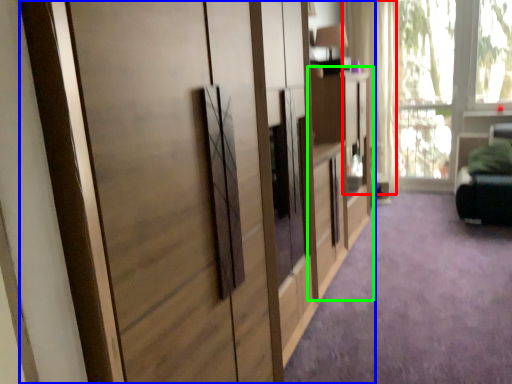
Question: Considering the real-world distances, which object is closest to curtain (highlighted by a red box)? cupboard (highlighted by a blue box) or dresser (highlighted by a green box).

Choices:
 (A) cupboard
 (B) dresser

Answer: (B)